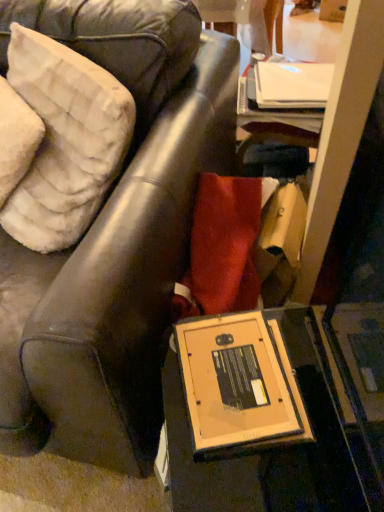
Question: From the image's perspective, relative to white fluffy pillow at upper left, the first pillow viewed from the left, is white plush pillow at upper left, which is the 1th pillow from right to left, above or below?

Choices:
 (A) below
 (B) above

Answer: (B)

Question: Is white plush pillow at upper left, which is the 1th pillow from right to left, bigger or smaller than white fluffy pillow at upper left, the first pillow viewed from the left?

Choices:
 (A) small
 (B) big

Answer: (B)

Question: Considering the real-world distances, which object is closest to the matte brown leather chair at center?

Choices:
 (A) white fluffy pillow at upper left, the second pillow when ordered from right to left
 (B) white plush pillow at upper left, the second pillow in the left-to-right sequence

Answer: (B)

Question: Considering the real-world distances, which object is farthest from the matte brown leather chair at center?

Choices:
 (A) white plush pillow at upper left, which is the 1th pillow from right to left
 (B) white fluffy pillow at upper left, the first pillow viewed from the left

Answer: (B)